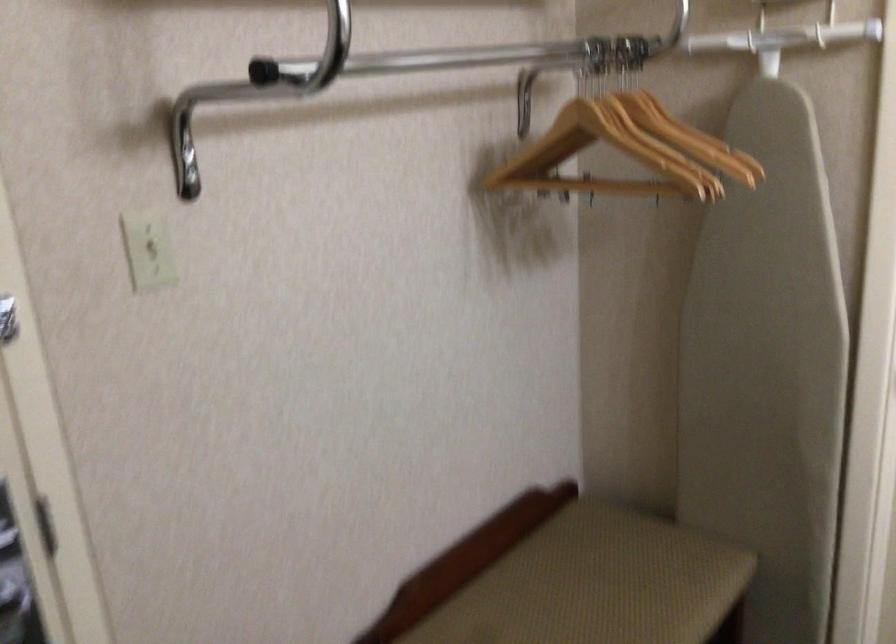
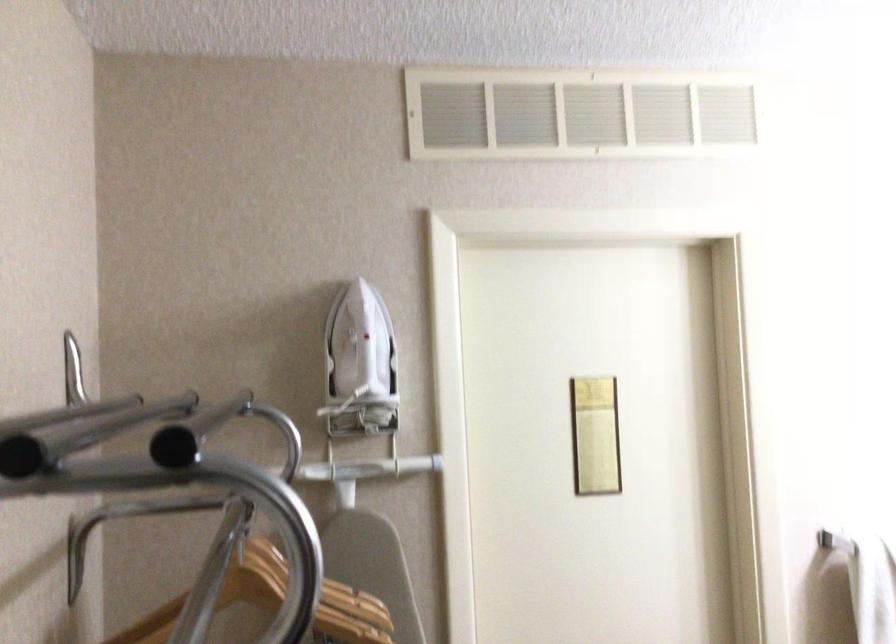
The first image is from the beginning of the video and the second image is from the end. How did the camera likely rotate when shooting the video?

The rotation direction of the camera is right-up.